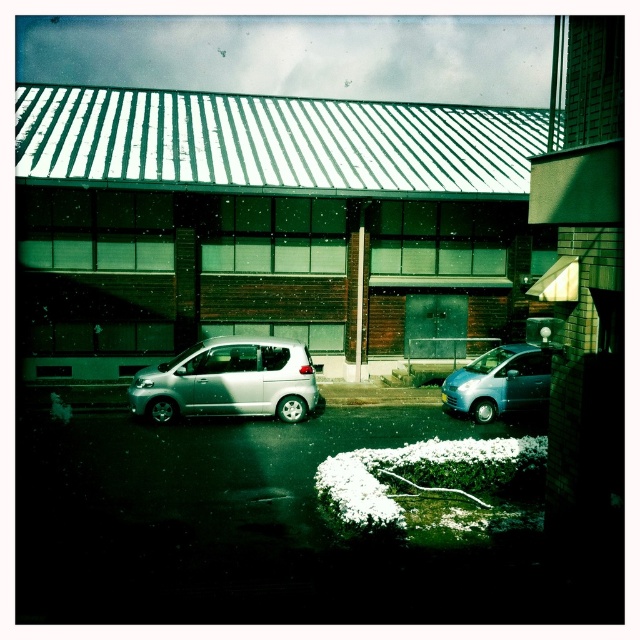
You are standing in the urban scene and want to place a small flag at one of the two points labeled point (308, 388) and point (499, 392). Which point is closer to you so the flag will be more visible?

Point (308, 388) is closer to the camera than point (499, 392), so placing the flag there would make it more visible.

You are a delivery person trying to park your van in the parking lot. You see a satin silver car at center and a satin silver van at center. Which vehicle should you move to the right to make space for your van?

You should move the satin silver car at center to the right since it is currently to the left of the satin silver van at center, allowing more space for your van.